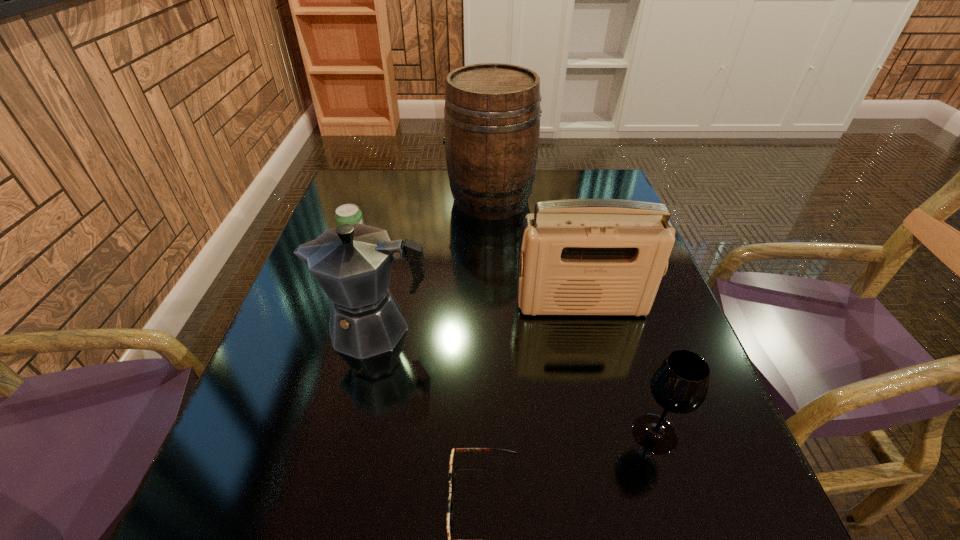
What are the coordinates of `free location located 0.250m on the side of the farthest object near the bung hole` in the screenshot? It's located at (363, 199).

At what (x,y) coordinates should I click in order to perform the action: click on vacant space located on the front-facing side of the radio receiver. Please return your answer as a coordinate pair (x, y). The image size is (960, 540). Looking at the image, I should click on (595, 361).

This screenshot has width=960, height=540. I want to click on vacant space located 0.240m on the left of the third shortest object, so click(x=492, y=434).

The height and width of the screenshot is (540, 960). In order to click on free region located 0.290m on the right of the fifth tallest object in this screenshot , I will do `click(481, 249)`.

This screenshot has height=540, width=960. I want to click on object at the far edge, so click(492, 111).

Where is `coffeepot that is at the left edge`? The width and height of the screenshot is (960, 540). coffeepot that is at the left edge is located at coordinates (352, 263).

The image size is (960, 540). Identify the location of soda that is positioned at the left edge. (348, 213).

Where is `radio receiver that is at the right edge`? radio receiver that is at the right edge is located at coordinates (588, 256).

I want to click on wineglass that is positioned at the right edge, so click(679, 384).

I want to click on free space at the far edge, so click(x=453, y=198).